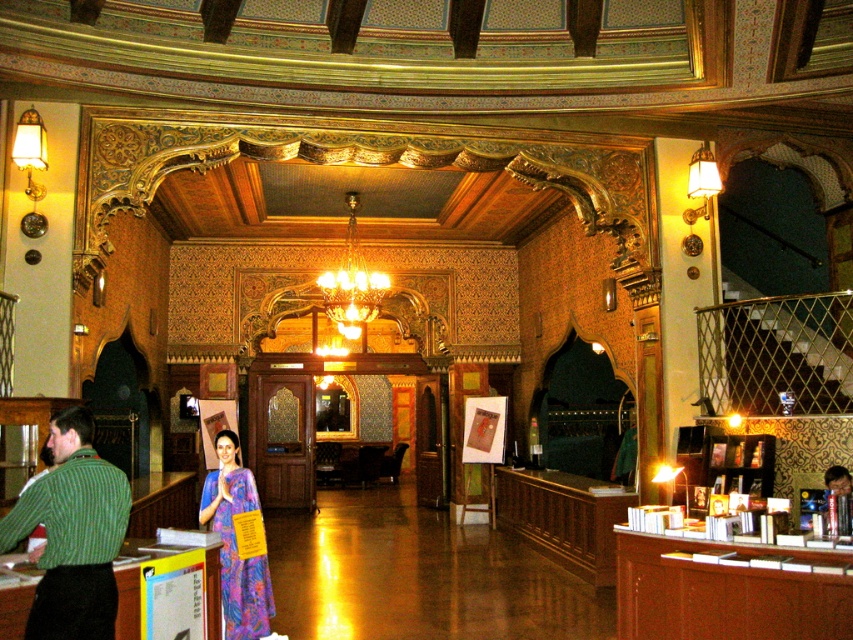
Can you confirm if brown wood/finish information desk at lower right is wider than crystal glass chandelier at center?

Indeed, brown wood/finish information desk at lower right has a greater width compared to crystal glass chandelier at center.

Is brown wood/finish information desk at lower right thinner than crystal glass chandelier at center?

No, brown wood/finish information desk at lower right is not thinner than crystal glass chandelier at center.

Is point (703, 541) in front of point (381, 285)?

Yes, it is in front of point (381, 285).

Locate an element on the screen. brown wood/finish information desk at lower right is located at coordinates (726, 589).

Is brown wood/finish information desk at lower right below vivid purple silk sari at center?

Correct, brown wood/finish information desk at lower right is located below vivid purple silk sari at center.

Which is in front, point (772, 609) or point (247, 476)?

Point (772, 609)

Does point (804, 550) come in front of point (229, 573)?

Yes.

The height and width of the screenshot is (640, 853). Find the location of `brown wood/finish information desk at lower right`. brown wood/finish information desk at lower right is located at coordinates (726, 589).

Does brown wood/finish information desk at lower right have a smaller size compared to green knitted sweater at lower left?

No.

Which is in front, point (650, 550) or point (76, 554)?

Point (76, 554) is more forward.

Describe the element at coordinates (726, 589) in the screenshot. I see `brown wood/finish information desk at lower right` at that location.

At what (x,y) coordinates should I click in order to perform the action: click on brown wood/finish information desk at lower right. Please return your answer as a coordinate pair (x, y). This screenshot has width=853, height=640. Looking at the image, I should click on pyautogui.click(x=726, y=589).